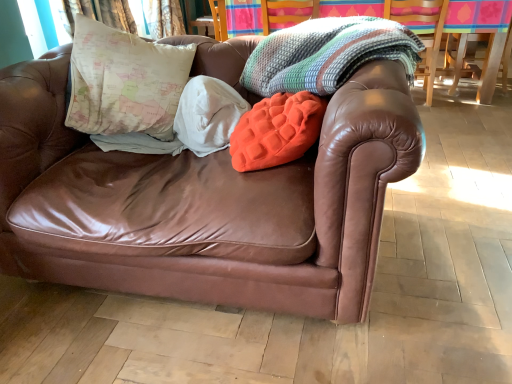
Question: Should I look upward or downward to see knitted multicolored blanket at upper center?

Choices:
 (A) down
 (B) up

Answer: (B)

Question: Is knitted multicolored blanket at upper center bigger than wooden swivel chair at upper right?

Choices:
 (A) no
 (B) yes

Answer: (A)

Question: Can you confirm if knitted multicolored blanket at upper center is smaller than wooden swivel chair at upper right?

Choices:
 (A) yes
 (B) no

Answer: (A)

Question: Is the depth of knitted multicolored blanket at upper center less than that of wooden swivel chair at upper right?

Choices:
 (A) no
 (B) yes

Answer: (B)

Question: From a real-world perspective, does knitted multicolored blanket at upper center sit lower than wooden swivel chair at upper right?

Choices:
 (A) yes
 (B) no

Answer: (B)

Question: Is knitted multicolored blanket at upper center at the right side of wooden swivel chair at upper right?

Choices:
 (A) no
 (B) yes

Answer: (A)

Question: Would you say knitted multicolored blanket at upper center is outside wooden swivel chair at upper right?

Choices:
 (A) no
 (B) yes

Answer: (B)

Question: Considering the relative sizes of orange fuzzy pillow at center and brown leather couch at center in the image provided, is orange fuzzy pillow at center bigger than brown leather couch at center?

Choices:
 (A) no
 (B) yes

Answer: (A)

Question: Could you tell me if orange fuzzy pillow at center is turned towards brown leather couch at center?

Choices:
 (A) yes
 (B) no

Answer: (A)

Question: Is the surface of orange fuzzy pillow at center in direct contact with brown leather couch at center?

Choices:
 (A) no
 (B) yes

Answer: (A)

Question: From the image's perspective, is orange fuzzy pillow at center under brown leather couch at center?

Choices:
 (A) no
 (B) yes

Answer: (A)

Question: Is orange fuzzy pillow at center taller than brown leather couch at center?

Choices:
 (A) no
 (B) yes

Answer: (A)

Question: Considering the relative positions of orange fuzzy pillow at center and brown leather couch at center in the image provided, is orange fuzzy pillow at center to the right of brown leather couch at center from the viewer's perspective?

Choices:
 (A) no
 (B) yes

Answer: (B)

Question: Is knitted multicolor blanket at upper center, marked as the 2th blanket in a left-to-right arrangement, next to brown leather couch at center and touching it?

Choices:
 (A) no
 (B) yes

Answer: (A)